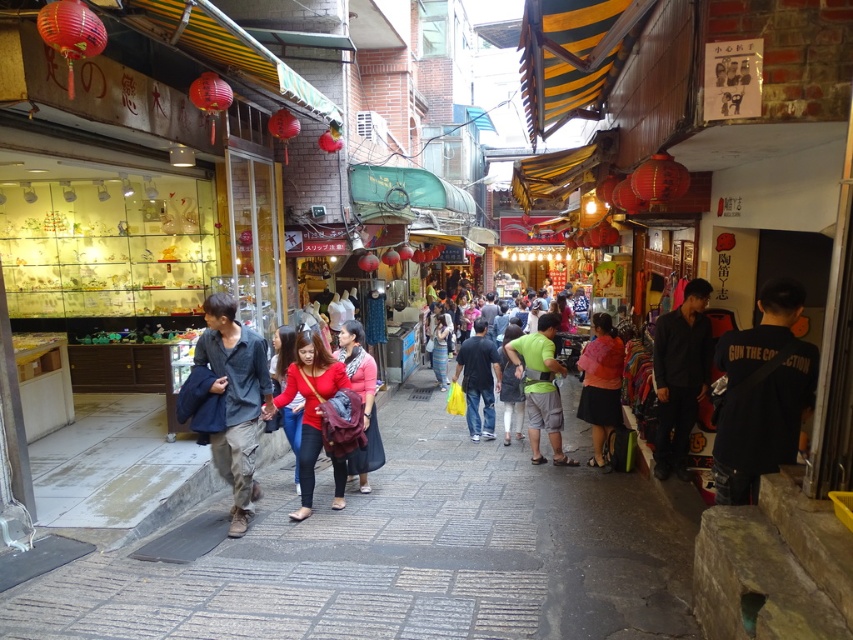
Question: Which point is closer to the camera?

Choices:
 (A) denim shirt at center
 (B) matte green shirt at center
 (C) matte pink shirt at center
 (D) pink matte jacket at center

Answer: (A)

Question: Which of the following is the farthest from the observer?

Choices:
 (A) matte pink shirt at center
 (B) red matte jacket at center

Answer: (A)

Question: Which of these objects is positioned closest to the pink matte jacket at center?

Choices:
 (A) green fabric shirt at center
 (B) red matte jacket at center

Answer: (A)

Question: Does green fabric shirt at center appear on the right side of matte pink shirt at center?

Choices:
 (A) yes
 (B) no

Answer: (A)

Question: From the image, what is the correct spatial relationship of red matte jacket at center in relation to pink matte jacket at center?

Choices:
 (A) below
 (B) above

Answer: (A)

Question: Can you confirm if red matte jacket at center is positioned below pink matte jacket at center?

Choices:
 (A) no
 (B) yes

Answer: (B)